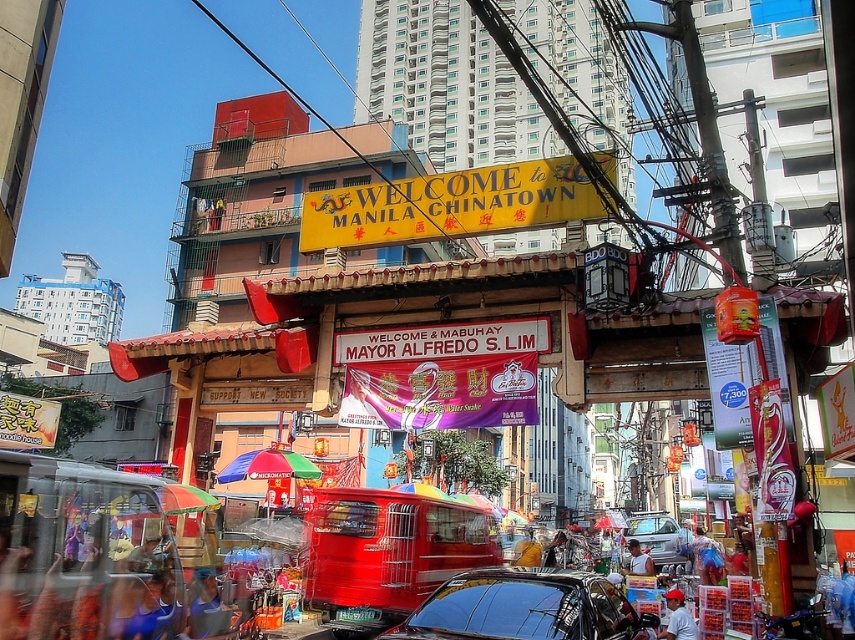
Question: Is metallic red food truck at center below yellow matte signboard at center?

Choices:
 (A) no
 (B) yes

Answer: (B)

Question: Which object is farther from the camera taking this photo?

Choices:
 (A) yellow fabric at center
 (B) light blue shirt at center

Answer: (B)

Question: Which point is closer to the camera?

Choices:
 (A) metallic red food truck at center
 (B) yellow matte signboard at center

Answer: (B)

Question: Does silver metallic car at center appear on the right side of red cap at center?

Choices:
 (A) no
 (B) yes

Answer: (B)

Question: Among these objects, which one is nearest to the camera?

Choices:
 (A) silver metallic car at center
 (B) red cap at center
 (C) metallic red food truck at center
 (D) yellow matte signboard at center

Answer: (B)

Question: Can you confirm if silver metallic car at center is bigger than light brown wooden chair at center?

Choices:
 (A) no
 (B) yes

Answer: (B)